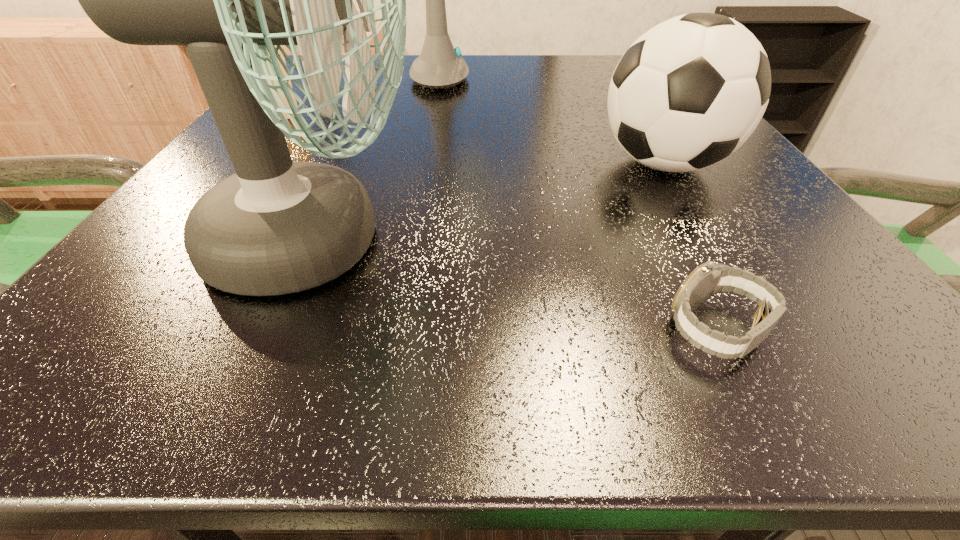
Locate an element on the screen. This screenshot has width=960, height=540. vacant region located on the face of the shortest object is located at coordinates (415, 330).

The width and height of the screenshot is (960, 540). What are the coordinates of `vacant area situated 0.350m on the face of the shortest object` in the screenshot? It's located at (313, 330).

The height and width of the screenshot is (540, 960). I want to click on vacant space located 0.300m on the face of the shortest object, so click(x=364, y=330).

Where is `object that is at the far edge`? The image size is (960, 540). object that is at the far edge is located at coordinates (440, 65).

Find the location of a particular element. fan at the near edge is located at coordinates (276, 227).

The width and height of the screenshot is (960, 540). Find the location of `watch that is at the near edge`. watch that is at the near edge is located at coordinates (709, 278).

The width and height of the screenshot is (960, 540). I want to click on fan that is at the left edge, so click(276, 227).

Locate an element on the screen. The height and width of the screenshot is (540, 960). candle present at the left edge is located at coordinates (284, 72).

The width and height of the screenshot is (960, 540). What are the coordinates of `soccer ball located at the right edge` in the screenshot? It's located at (689, 92).

Where is `watch that is at the right edge`? watch that is at the right edge is located at coordinates (709, 278).